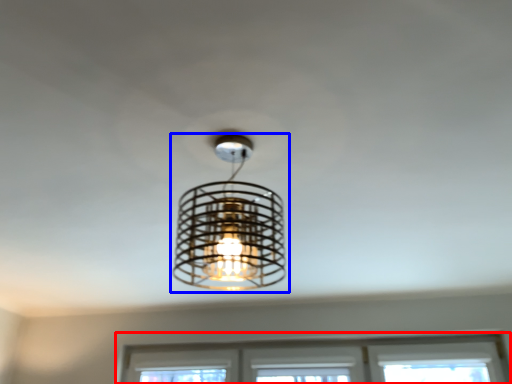
Question: Which object appears closest to the camera in this image, window (highlighted by a red box) or lamp (highlighted by a blue box)?

Choices:
 (A) window
 (B) lamp

Answer: (B)